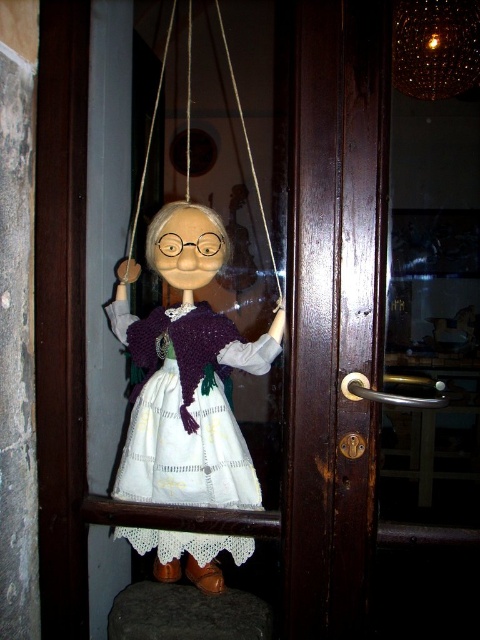
Which is more to the right, white lace dress at center or silky brown string at upper center?

white lace dress at center is more to the right.

This screenshot has height=640, width=480. What are the coordinates of `white lace dress at center` in the screenshot? It's located at (192, 429).

Is white string at upper center further to the viewer compared to silky brown string at upper center?

No, it is not.

Is point (216, 0) farther from camera compared to point (147, 147)?

No, (216, 0) is in front of (147, 147).

The image size is (480, 640). In order to click on white string at upper center in this screenshot , I will do `click(249, 150)`.

Where is `white lace dress at center`? This screenshot has width=480, height=640. white lace dress at center is located at coordinates (192, 429).

Is point (216, 426) positioned after point (224, 49)?

No.

Where is `white lace dress at center`? white lace dress at center is located at coordinates (192, 429).